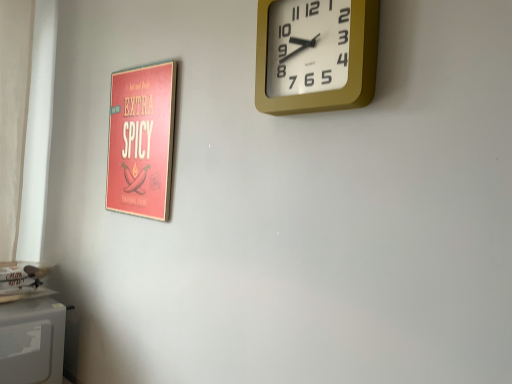
Question: Considering the relative sizes of matte red poster at left and gold metallic wall clock at upper right in the image provided, is matte red poster at left smaller than gold metallic wall clock at upper right?

Choices:
 (A) no
 (B) yes

Answer: (B)

Question: Is matte red poster at left oriented towards gold metallic wall clock at upper right?

Choices:
 (A) no
 (B) yes

Answer: (A)

Question: Is the depth of matte red poster at left greater than that of gold metallic wall clock at upper right?

Choices:
 (A) yes
 (B) no

Answer: (A)

Question: Does matte red poster at left have a lesser width compared to gold metallic wall clock at upper right?

Choices:
 (A) no
 (B) yes

Answer: (B)

Question: Considering the relative positions of matte red poster at left and gold metallic wall clock at upper right in the image provided, is matte red poster at left to the right of gold metallic wall clock at upper right from the viewer's perspective?

Choices:
 (A) no
 (B) yes

Answer: (A)

Question: Are matte red poster at left and gold metallic wall clock at upper right located far from each other?

Choices:
 (A) no
 (B) yes

Answer: (A)

Question: Can you confirm if gold metallic wall clock at upper right is shorter than matte red poster at left?

Choices:
 (A) yes
 (B) no

Answer: (A)

Question: Can you confirm if gold metallic wall clock at upper right is positioned to the right of matte red poster at left?

Choices:
 (A) yes
 (B) no

Answer: (A)

Question: From the image's perspective, is gold metallic wall clock at upper right under matte red poster at left?

Choices:
 (A) yes
 (B) no

Answer: (B)

Question: Is gold metallic wall clock at upper right placed right next to matte red poster at left?

Choices:
 (A) no
 (B) yes

Answer: (A)

Question: From a real-world perspective, does gold metallic wall clock at upper right sit lower than matte red poster at left?

Choices:
 (A) yes
 (B) no

Answer: (B)

Question: From a real-world perspective, is gold metallic wall clock at upper right located higher than matte red poster at left?

Choices:
 (A) no
 (B) yes

Answer: (B)

Question: From a real-world perspective, is matte red poster at left located beneath white matte microwave at lower left?

Choices:
 (A) yes
 (B) no

Answer: (B)